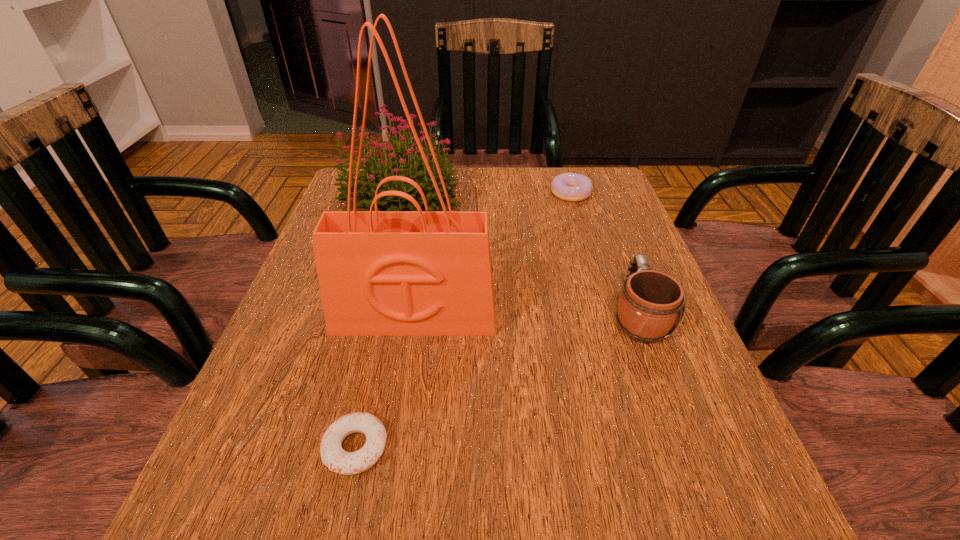
Locate an element on the screen. This screenshot has width=960, height=540. doughnut situated at the right edge is located at coordinates (572, 187).

The width and height of the screenshot is (960, 540). I want to click on object present at the far left corner, so click(x=396, y=163).

Identify the location of object that is at the far right corner. (572, 187).

This screenshot has width=960, height=540. I want to click on vacant region at the far edge of the desktop, so click(x=551, y=199).

The image size is (960, 540). What are the coordinates of `vacant space at the near edge of the desktop` in the screenshot? It's located at (373, 507).

Find the location of a particular element. Image resolution: width=960 pixels, height=540 pixels. vacant area at the left edge of the desktop is located at coordinates (299, 299).

In the image, there is a desktop. What are the coordinates of `vacant space at the right edge` in the screenshot? It's located at (612, 327).

The height and width of the screenshot is (540, 960). In the image, there is a desktop. In order to click on vacant region at the far right corner in this screenshot , I will do [x=558, y=173].

You are a GUI agent. You are given a task and a screenshot of the screen. Output one action in this format:
    pyautogui.click(x=<x>, y=<y>)
    Task: Click on the vacant region between the farther doughnut and the tallest object
    Image resolution: width=960 pixels, height=540 pixels.
    Given the screenshot: What is the action you would take?
    pyautogui.click(x=492, y=254)

Find the location of a particular element. This screenshot has width=960, height=540. unoccupied position between the tote bag and the fourth tallest object is located at coordinates (492, 254).